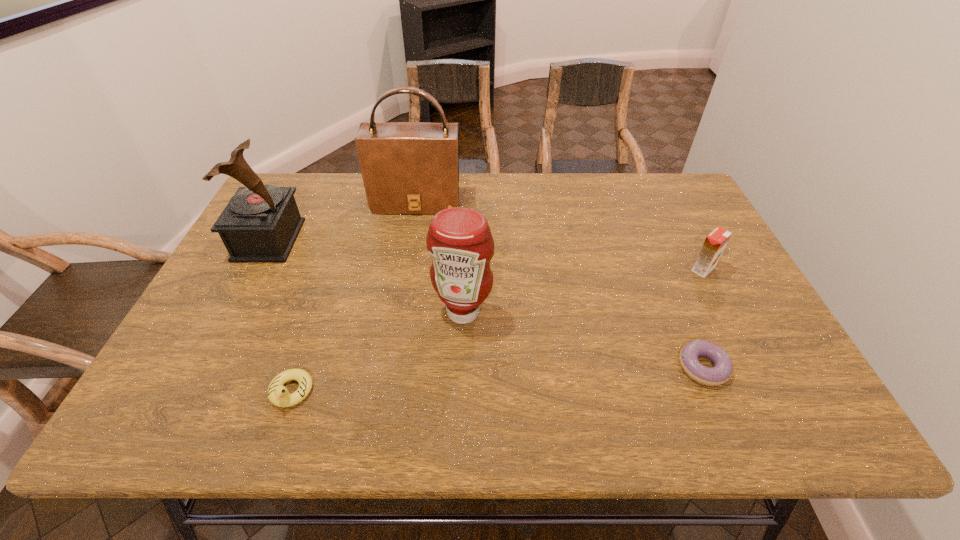
Identify the location of vacant space at the near edge of the desktop. The height and width of the screenshot is (540, 960). (419, 398).

The width and height of the screenshot is (960, 540). I want to click on vacant space at the right edge, so click(x=704, y=220).

Locate an element on the screen. This screenshot has height=540, width=960. blank space at the far left corner is located at coordinates (283, 185).

The width and height of the screenshot is (960, 540). I want to click on vacant space at the far right corner of the desktop, so (x=669, y=201).

You are a GUI agent. You are given a task and a screenshot of the screen. Output one action in this format:
    pyautogui.click(x=<x>, y=<y>)
    Task: Click on the free space at the near right corner of the desktop
    Image resolution: width=960 pixels, height=540 pixels.
    Given the screenshot: What is the action you would take?
    pyautogui.click(x=802, y=396)

The width and height of the screenshot is (960, 540). Identify the location of vacant area that lies between the second object from right to left and the farthest object. click(x=560, y=285).

I want to click on vacant space that's between the farthest object and the doughnut, so click(560, 285).

The image size is (960, 540). Find the location of `free area in between the third nearest object and the rightmost object`. free area in between the third nearest object and the rightmost object is located at coordinates (583, 291).

Where is `vacant space in between the shortest object and the condiment`? vacant space in between the shortest object and the condiment is located at coordinates (583, 339).

At what (x,y) coordinates should I click in order to perform the action: click on empty space that is in between the leftmost object and the fifth tallest object. Please return your answer as a coordinate pair (x, y). This screenshot has width=960, height=540. Looking at the image, I should click on (280, 316).